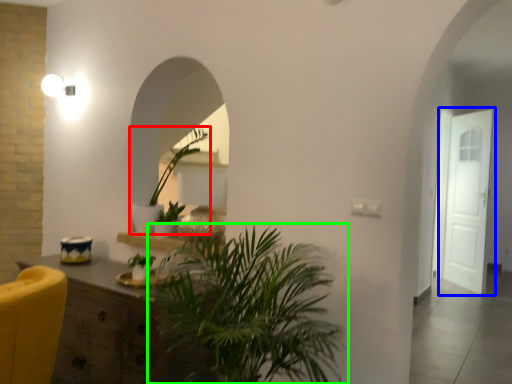
Question: Which object is the farthest from houseplant (highlighted by a red box)? Choose among these: door (highlighted by a blue box) or houseplant (highlighted by a green box).

Choices:
 (A) door
 (B) houseplant

Answer: (A)